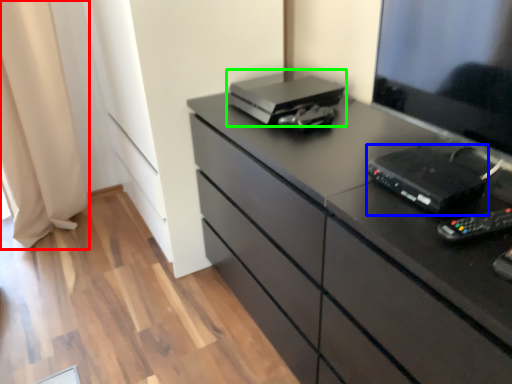
Question: Which object is the closest to the curtain (highlighted by a red box)? Choose among these: equipment (highlighted by a blue box) or printer (highlighted by a green box).

Choices:
 (A) equipment
 (B) printer

Answer: (B)